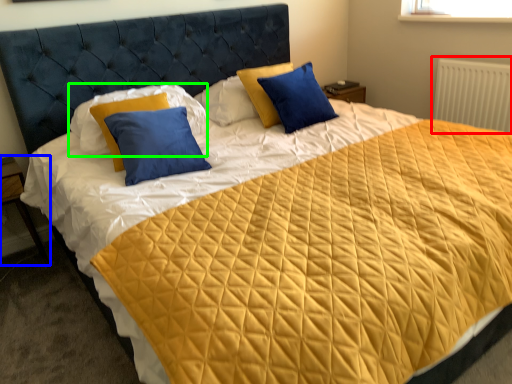
Question: Considering the real-world distances, which object is farthest from radiator (highlighted by a red box)? nightstand (highlighted by a blue box) or pillow (highlighted by a green box)?

Choices:
 (A) nightstand
 (B) pillow

Answer: (A)